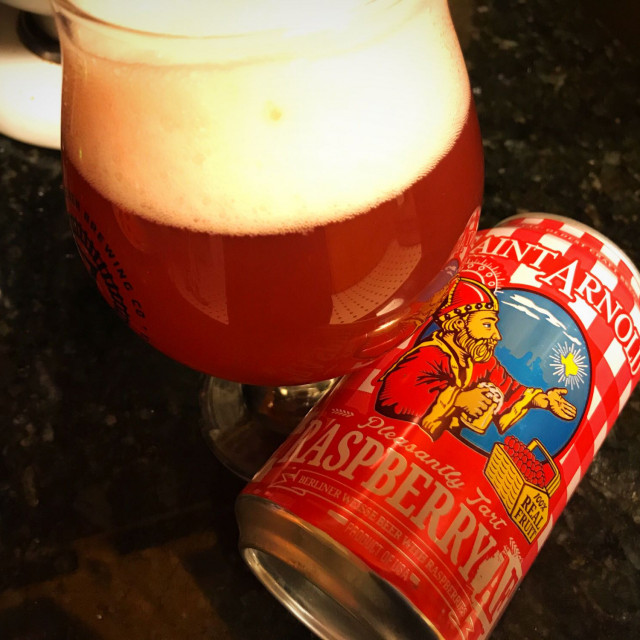
This screenshot has width=640, height=640. I want to click on basket handle, so click(x=557, y=473).